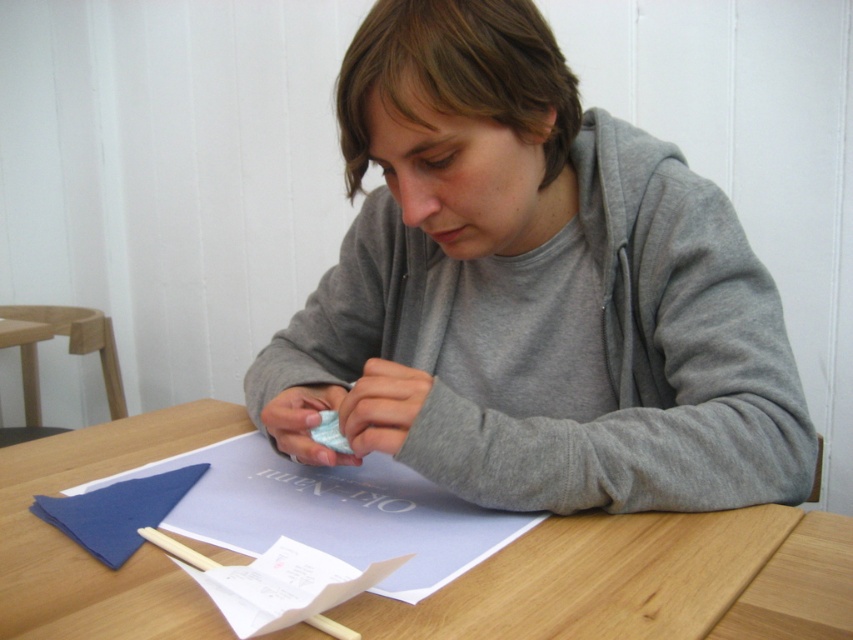
This screenshot has height=640, width=853. Identify the location of gray cotton hoodie at center. (532, 291).

Which is below, gray cotton hoodie at center or wooden table at center?

wooden table at center

Measure the distance between gray cotton hoodie at center and camera.

gray cotton hoodie at center and camera are 56.33 centimeters apart.

I want to click on gray cotton hoodie at center, so (532, 291).